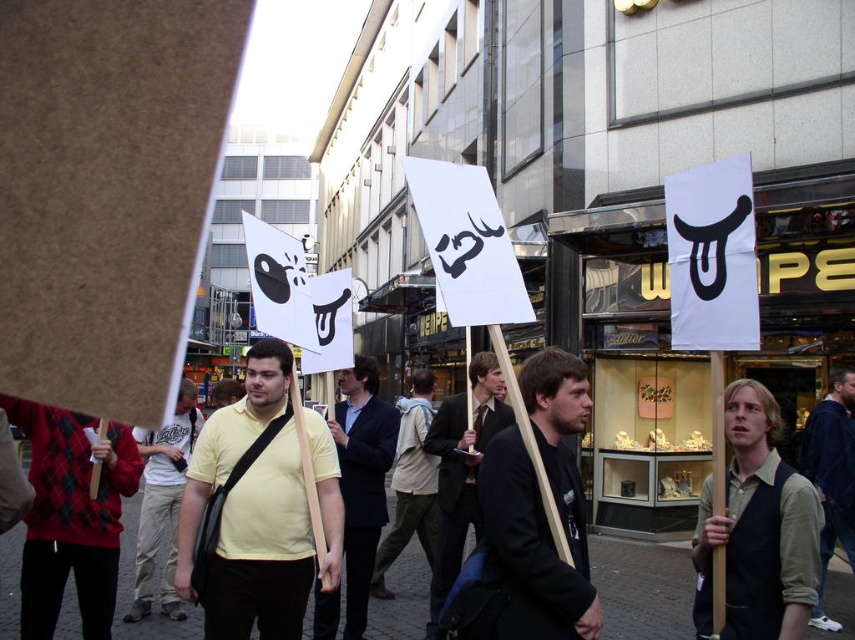
You are standing in the middle of the protest scene. There are two points marked in the image. The first point is at coordinates point (770, 516) and the second point is at point (434, 548). Which point is closer to you?

Point (770, 516) is closer to the viewer than point (434, 548).

You are a photographer standing at the front of the protest scene. You want to take a photo that captures both the light brown fabric vest at center and the black suit at center clearly. Which object should you focus on first to ensure both are in sharp focus?

The light brown fabric vest at center is closer to the viewer than the black suit at center. To ensure both are in sharp focus, you should focus on the light brown fabric vest at center first, as focusing on the closer object allows the depth of field to extend to the farther one.

You are a photographer at the protest scene. You want to take a photo that includes both the light brown fabric vest at center and the yellow shirt at center. Which one should you focus on to ensure the vest is visible in the frame?

The light brown fabric vest at center is above the yellow shirt at center, so focusing on the vest will ensure both are in the frame since it is positioned higher up.